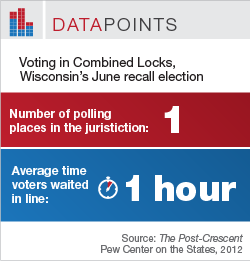
Where is `clock hand`? This screenshot has height=261, width=250. clock hand is located at coordinates (110, 185), (108, 183).